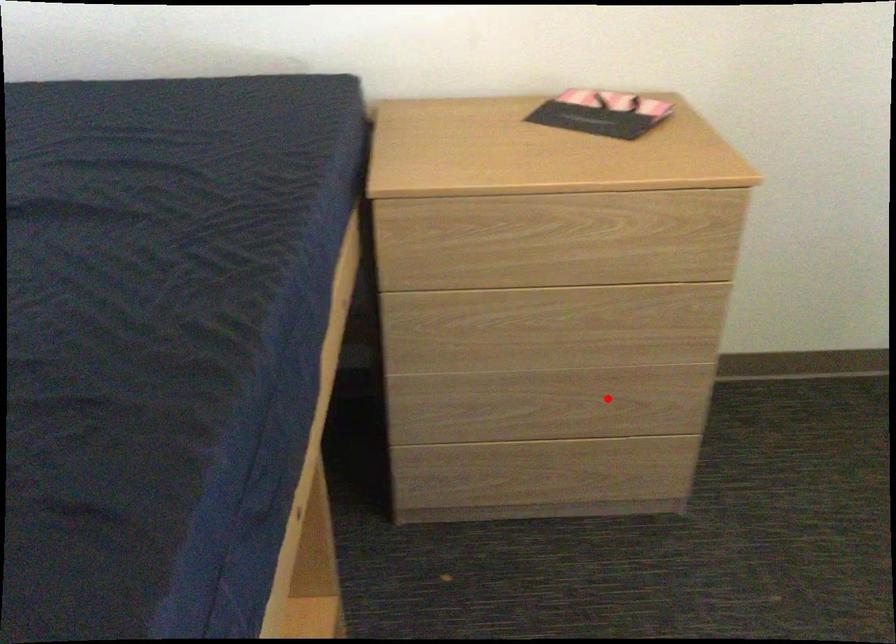
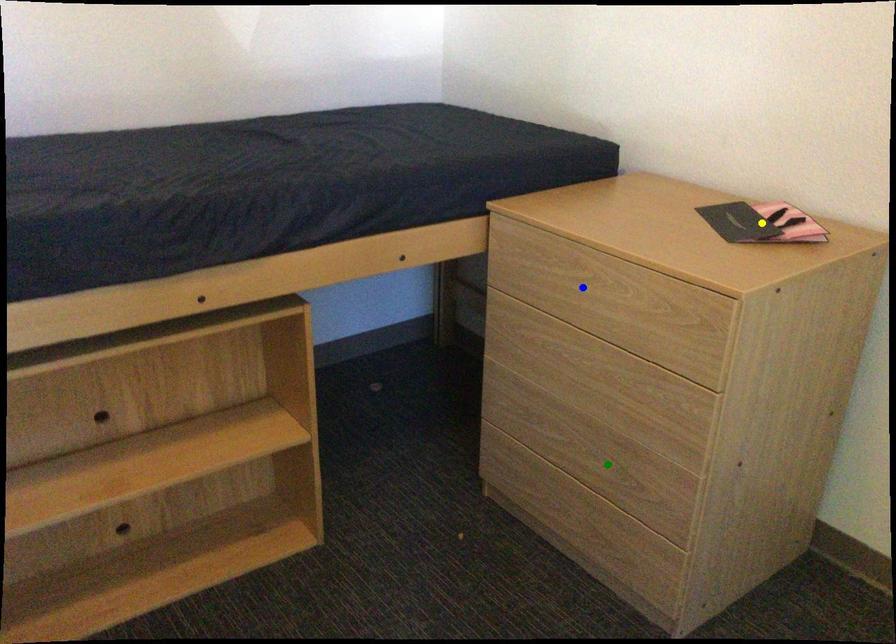
Question: I am providing you with two images of the same scene from different viewpoints. A red point is marked on the first image. You are given multiple points on the second image. Which spot in image 2 lines up with the point in image 1?

Choices:
 (A) yellow point
 (B) green point
 (C) blue point

Answer: (B)